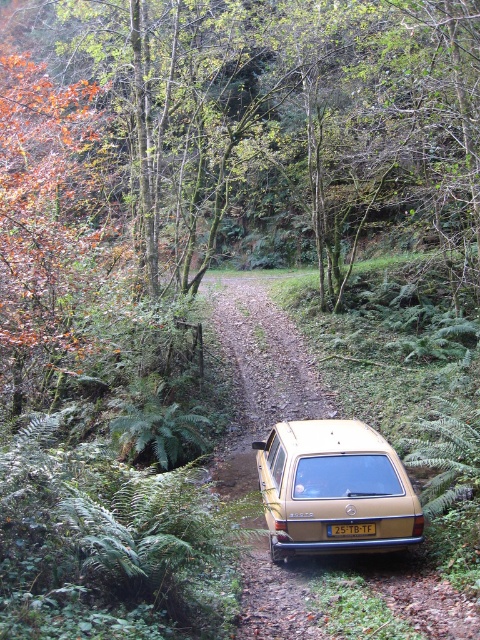
Is gold matte station wagon at center shorter than yellow plastic license plate at center?

Incorrect, gold matte station wagon at center's height does not fall short of yellow plastic license plate at center's.

Is gold matte station wagon at center smaller than yellow plastic license plate at center?

No, gold matte station wagon at center is not smaller than yellow plastic license plate at center.

At what (x,y) coordinates should I click in order to perform the action: click on gold matte station wagon at center. Please return your answer as a coordinate pair (x, y). The image size is (480, 640). Looking at the image, I should click on (334, 488).

In the scene shown: Between brown leafy tree at upper left and gold matte station wagon at center, which one is positioned higher?

brown leafy tree at upper left is above.

Who is positioned more to the left, brown leafy tree at upper left or gold matte station wagon at center?

brown leafy tree at upper left is more to the left.

What do you see at coordinates (283, 116) in the screenshot?
I see `brown leafy tree at upper left` at bounding box center [283, 116].

Find the location of `brown leafy tree at upper left`. brown leafy tree at upper left is located at coordinates (283, 116).

What do you see at coordinates (283, 116) in the screenshot?
I see `brown leafy tree at upper left` at bounding box center [283, 116].

Who is higher up, brown leafy tree at upper left or yellow plastic license plate at center?

brown leafy tree at upper left

This screenshot has height=640, width=480. What are the coordinates of `brown leafy tree at upper left` in the screenshot? It's located at click(283, 116).